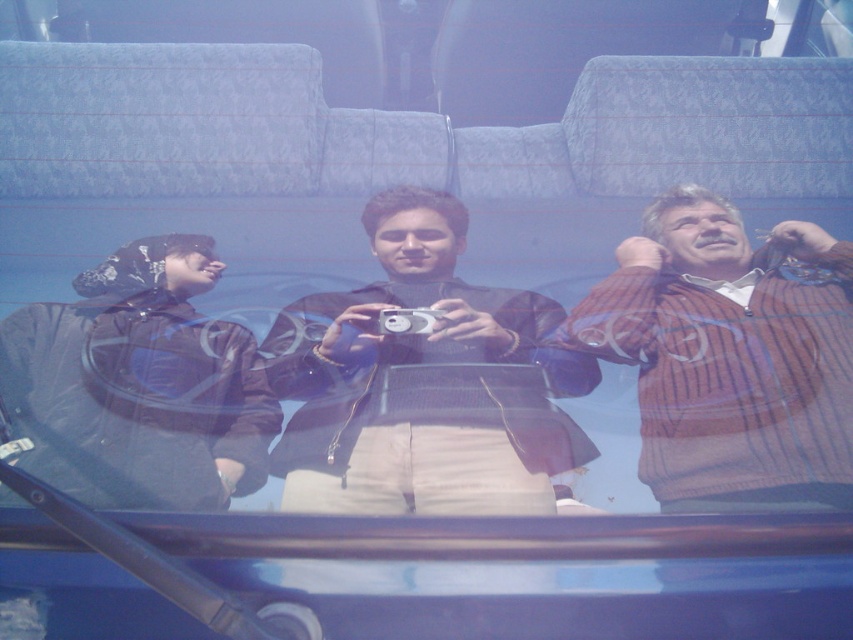
You are a photographer trying to capture a candid shot of the striped sweater at right and the silver metallic camera at center from your position inside the bus. Which object should you focus on first to ensure it appears sharp in your photo?

The striped sweater at right is closer to the viewer than the silver metallic camera at center, so you should focus on the striped sweater at right first to ensure it appears sharp.

Looking at this image, you are a photographer trying to capture a clear photo of the silver metallic camera at center. However, the black matte jacket at left is blocking your view. Can you determine if the jacket is large enough to completely obscure the camera from your current viewpoint?

The black matte jacket at left is larger in size than silver metallic camera at center, so it is possible that the jacket could completely obscure the camera depending on their positions.

You are a passenger on a bus and you want to know which of the two items, the striped sweater at right or the black matte jacket at left, takes up more space in the image. Which one is bigger?

The striped sweater at right is larger in size than the black matte jacket at left, so it takes up more space in the image.